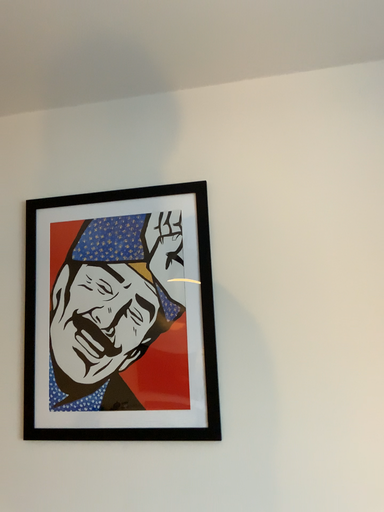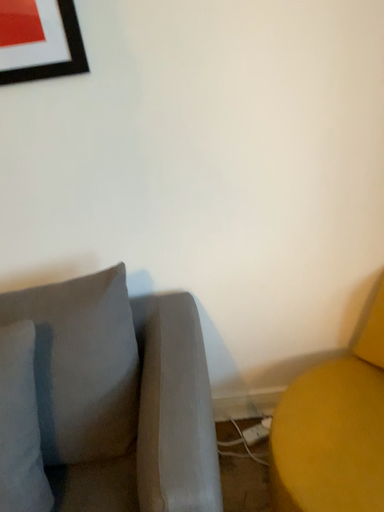
Question: How did the camera likely rotate when shooting the video?

Choices:
 (A) rotated left
 (B) rotated right

Answer: (B)